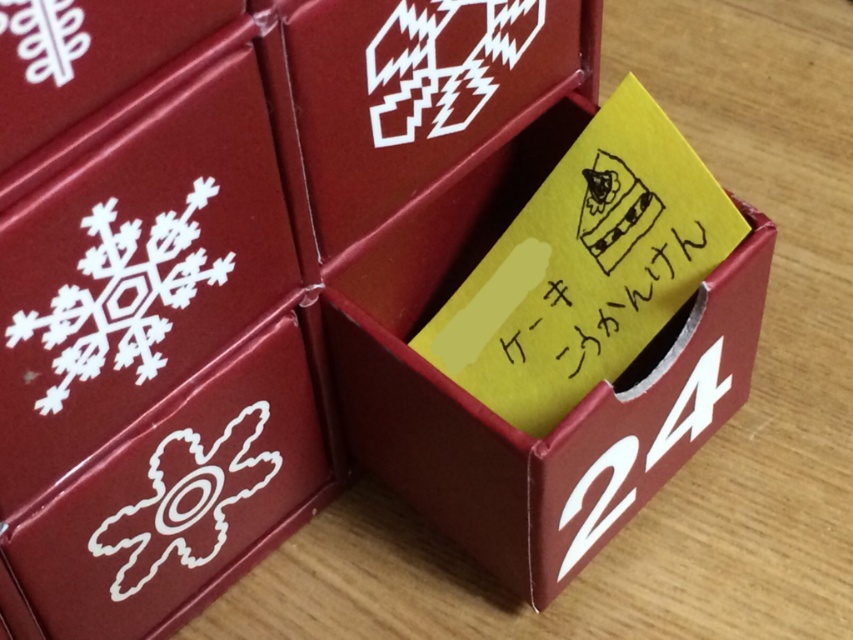
You are an app developer creating an AR app that needs to place a virtual cake on top of the matte paper box at center. The AR system uses a coordinate system where the bottom left corner is the origin. What are the coordinates you should input to place the cake precisely?

The coordinates for the matte paper box at center are at point (498, 417), so you should input those coordinates to place the cake precisely on top of the matte paper box at center.